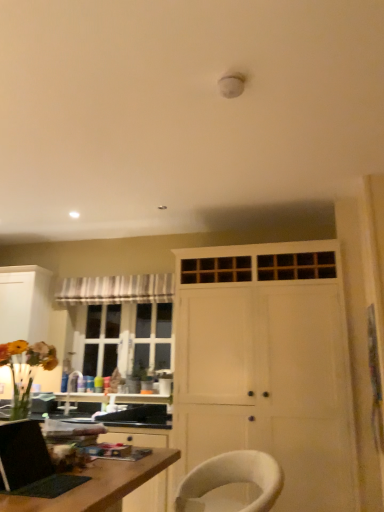
Question: From a real-world perspective, is wooden desk at lower left located beneath matte black laptop at lower left?

Choices:
 (A) no
 (B) yes

Answer: (B)

Question: Does wooden desk at lower left have a greater width compared to matte black laptop at lower left?

Choices:
 (A) no
 (B) yes

Answer: (B)

Question: Would you say wooden desk at lower left contains matte black laptop at lower left?

Choices:
 (A) yes
 (B) no

Answer: (B)

Question: From the image's perspective, is wooden desk at lower left beneath matte black laptop at lower left?

Choices:
 (A) no
 (B) yes

Answer: (B)

Question: Could you tell me if wooden desk at lower left is facing matte black laptop at lower left?

Choices:
 (A) no
 (B) yes

Answer: (A)

Question: Is wooden desk at lower left in front of or behind white fabric chair at lower center in the image?

Choices:
 (A) front
 (B) behind

Answer: (A)

Question: Is wooden desk at lower left bigger or smaller than white fabric chair at lower center?

Choices:
 (A) big
 (B) small

Answer: (A)

Question: Considering the positions of point (112, 490) and point (190, 483), is point (112, 490) closer or farther from the camera than point (190, 483)?

Choices:
 (A) closer
 (B) farther

Answer: (A)

Question: Considering the relative positions of wooden desk at lower left and white fabric chair at lower center in the image provided, is wooden desk at lower left to the left or to the right of white fabric chair at lower center?

Choices:
 (A) right
 (B) left

Answer: (B)

Question: Is white matte cabinet at left, marked as the 2th cabinetry in a right-to-left arrangement, bigger or smaller than striped fabric curtain at upper left?

Choices:
 (A) big
 (B) small

Answer: (A)

Question: Considering the positions of white matte cabinet at left, the 1th cabinetry positioned from the back, and striped fabric curtain at upper left in the image, is white matte cabinet at left, the 1th cabinetry positioned from the back, taller or shorter than striped fabric curtain at upper left?

Choices:
 (A) tall
 (B) short

Answer: (A)

Question: From the image's perspective, relative to striped fabric curtain at upper left, is white matte cabinet at left, the 1th cabinetry positioned from the back, above or below?

Choices:
 (A) above
 (B) below

Answer: (B)

Question: In the image, is white matte cabinet at left, marked as the 2th cabinetry in a right-to-left arrangement, positioned in front of or behind striped fabric curtain at upper left?

Choices:
 (A) behind
 (B) front

Answer: (B)

Question: In terms of size, does white matte cabinet at left, marked as the 2th cabinetry in a right-to-left arrangement, appear bigger or smaller than wooden desk at lower left?

Choices:
 (A) small
 (B) big

Answer: (A)

Question: In terms of height, does white matte cabinet at left, the first cabinetry when ordered from left to right, look taller or shorter compared to wooden desk at lower left?

Choices:
 (A) short
 (B) tall

Answer: (B)